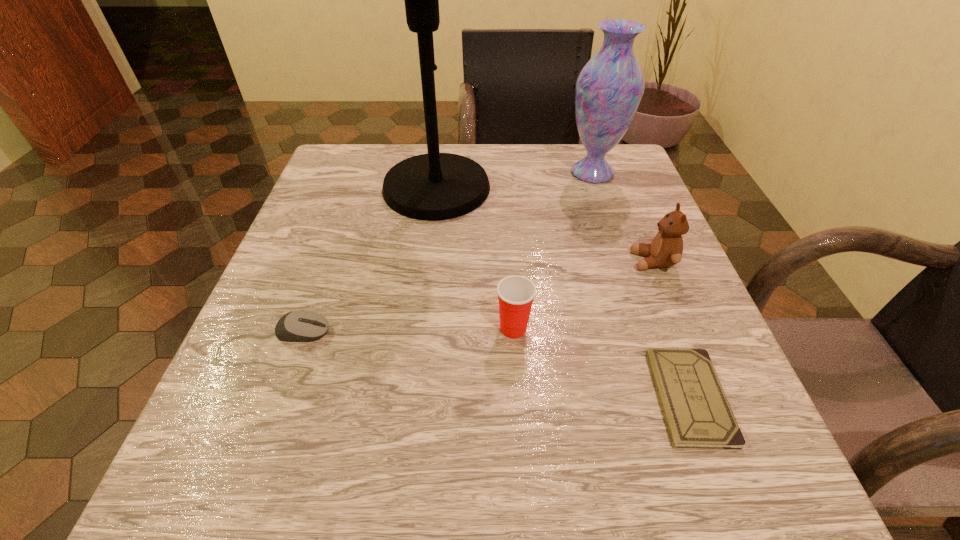
Where is `vacant space located on the front of the second tallest object`? This screenshot has width=960, height=540. vacant space located on the front of the second tallest object is located at coordinates (639, 314).

The height and width of the screenshot is (540, 960). Identify the location of vacant region located 0.130m on the front-facing side of the teddy bear. (561, 261).

At what (x,y) coordinates should I click in order to perform the action: click on vacant space located 0.260m on the front-facing side of the teddy bear. Please return your answer as a coordinate pair (x, y). Looking at the image, I should click on (x=490, y=261).

Where is `free location located on the front-facing side of the teddy bear`? free location located on the front-facing side of the teddy bear is located at coordinates (435, 261).

You are a GUI agent. You are given a task and a screenshot of the screen. Output one action in this format:
    pyautogui.click(x=<x>, y=<y>)
    Task: Click on the free location located on the back of the fourth tallest object
    Image resolution: width=960 pixels, height=540 pixels.
    Given the screenshot: What is the action you would take?
    pyautogui.click(x=507, y=229)

At what (x,y) coordinates should I click in order to perform the action: click on blank space located 0.360m on the wheel side of the computer equipment. Please return your answer as a coordinate pair (x, y). Looking at the image, I should click on (560, 332).

What are the coordinates of `free space located 0.310m on the back of the checkbook` in the screenshot? It's located at (625, 225).

What are the coordinates of `table lamp at the far edge` in the screenshot? It's located at (435, 186).

In order to click on vase at the far edge in this screenshot , I will do pyautogui.click(x=609, y=88).

Where is `object located at the near edge`? Image resolution: width=960 pixels, height=540 pixels. object located at the near edge is located at coordinates (697, 413).